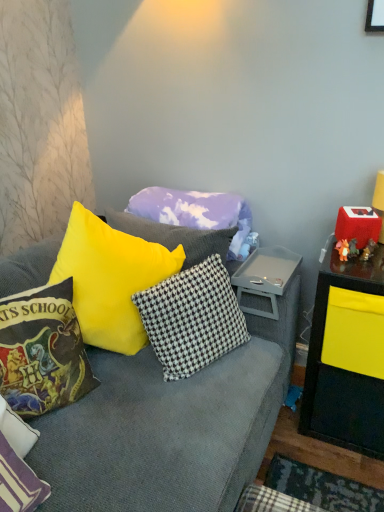
Question: Does white textured pillow at lower left, which appears as the 1th pillow when viewed from the front, appear on the right side of velvet harry potter-themed pillow at left, which ranks as the 2th pillow in front-to-back order?

Choices:
 (A) yes
 (B) no

Answer: (B)

Question: Would you say white textured pillow at lower left, which appears as the 1th pillow when viewed from the front, is a long distance from velvet harry potter-themed pillow at left, which ranks as the 2th pillow in front-to-back order?

Choices:
 (A) no
 (B) yes

Answer: (A)

Question: Is white textured pillow at lower left, which appears as the 1th pillow when viewed from the front, smaller than velvet harry potter-themed pillow at left, which ranks as the 2th pillow in front-to-back order?

Choices:
 (A) yes
 (B) no

Answer: (A)

Question: From the image's perspective, would you say white textured pillow at lower left, which appears as the 1th pillow when viewed from the front, is positioned over velvet harry potter-themed pillow at left, which ranks as the 2th pillow in front-to-back order?

Choices:
 (A) no
 (B) yes

Answer: (A)

Question: Is white textured pillow at lower left, the 4th pillow when ordered from back to front, in front of velvet harry potter-themed pillow at left, which ranks as the 2th pillow in front-to-back order?

Choices:
 (A) no
 (B) yes

Answer: (B)

Question: Does white textured pillow at lower left, which appears as the 1th pillow when viewed from the front, come behind velvet harry potter-themed pillow at left, which ranks as the 2th pillow in front-to-back order?

Choices:
 (A) yes
 (B) no

Answer: (B)

Question: Is white textured pillow at lower left, which appears as the 1th pillow when viewed from the front, surrounded by cloud-patterned fabric pillow at center, the 1th pillow from the back?

Choices:
 (A) yes
 (B) no

Answer: (B)

Question: Is cloud-patterned fabric pillow at center, the 1th pillow from the back, further to the viewer compared to white textured pillow at lower left, the 4th pillow when ordered from back to front?

Choices:
 (A) yes
 (B) no

Answer: (A)

Question: Can you confirm if cloud-patterned fabric pillow at center, the 1th pillow from the back, is shorter than white textured pillow at lower left, which appears as the 1th pillow when viewed from the front?

Choices:
 (A) no
 (B) yes

Answer: (A)

Question: From the image's perspective, would you say cloud-patterned fabric pillow at center, placed as the fourth pillow when sorted from front to back, is positioned over white textured pillow at lower left, which appears as the 1th pillow when viewed from the front?

Choices:
 (A) no
 (B) yes

Answer: (B)

Question: Is cloud-patterned fabric pillow at center, the 1th pillow from the back, oriented away from white textured pillow at lower left, the 4th pillow when ordered from back to front?

Choices:
 (A) yes
 (B) no

Answer: (B)

Question: Is cloud-patterned fabric pillow at center, the 1th pillow from the back, oriented towards white textured pillow at lower left, the 4th pillow when ordered from back to front?

Choices:
 (A) no
 (B) yes

Answer: (B)

Question: From the image's perspective, would you say velvet harry potter-themed pillow at left, which is the 3th pillow from back to front, is shown under white textured pillow at lower left, the 4th pillow when ordered from back to front?

Choices:
 (A) yes
 (B) no

Answer: (B)